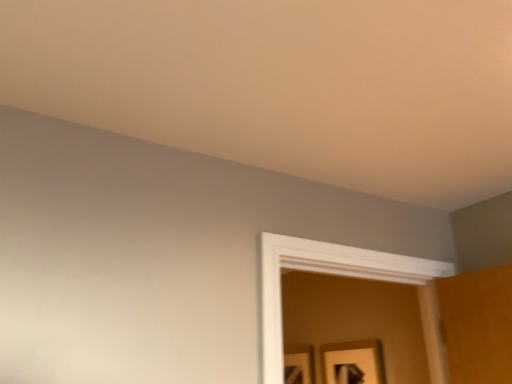
Question: Is matte black picture frame at lower center, the 1th picture frame in the left-to-right sequence, wider or thinner than wooden framed picture at lower right, the second picture frame positioned from the back?

Choices:
 (A) wide
 (B) thin

Answer: (B)

Question: In terms of size, does matte black picture frame at lower center, which is counted as the 1th picture frame, starting from the back, appear bigger or smaller than wooden framed picture at lower right, the second picture frame positioned from the back?

Choices:
 (A) small
 (B) big

Answer: (A)

Question: Visually, is matte black picture frame at lower center, the 1th picture frame in the left-to-right sequence, positioned to the left or to the right of wooden framed picture at lower right, which is the 2th picture frame in left-to-right order?

Choices:
 (A) right
 (B) left

Answer: (B)

Question: From a real-world perspective, is wooden framed picture at lower right, the 1th picture frame in the right-to-left sequence, above or below matte black picture frame at lower center, the 1th picture frame in the left-to-right sequence?

Choices:
 (A) above
 (B) below

Answer: (A)

Question: Is wooden framed picture at lower right, the 1th picture frame viewed from the front, taller or shorter than matte black picture frame at lower center, the 2th picture frame when ordered from front to back?

Choices:
 (A) short
 (B) tall

Answer: (A)

Question: From the image's perspective, relative to matte black picture frame at lower center, the second picture frame positioned from the right, is wooden framed picture at lower right, the 1th picture frame viewed from the front, above or below?

Choices:
 (A) above
 (B) below

Answer: (A)

Question: Is wooden framed picture at lower right, the 1th picture frame viewed from the front, in front of or behind matte black picture frame at lower center, which is counted as the 1th picture frame, starting from the back, in the image?

Choices:
 (A) front
 (B) behind

Answer: (A)